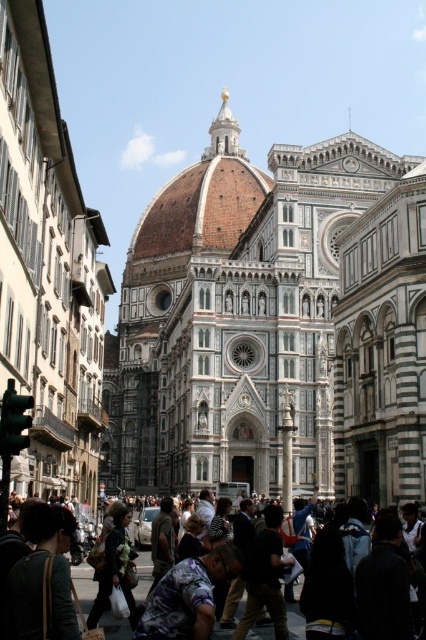
Which of these two, white marble church at center or dark clothing crowd at center, stands taller?

white marble church at center is taller.

You are a GUI agent. You are given a task and a screenshot of the screen. Output one action in this format:
    pyautogui.click(x=<x>, y=<y>)
    Task: Click on the white marble church at center
    The image size is (426, 640).
    Given the screenshot: What is the action you would take?
    coord(276,324)